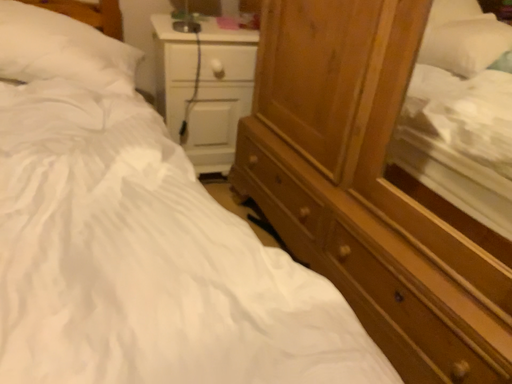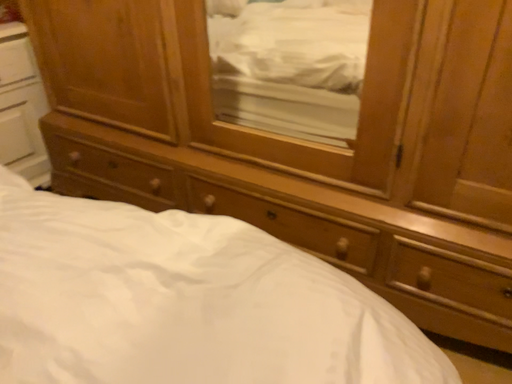
Question: How did the camera likely rotate when shooting the video?

Choices:
 (A) rotated left
 (B) rotated right

Answer: (B)